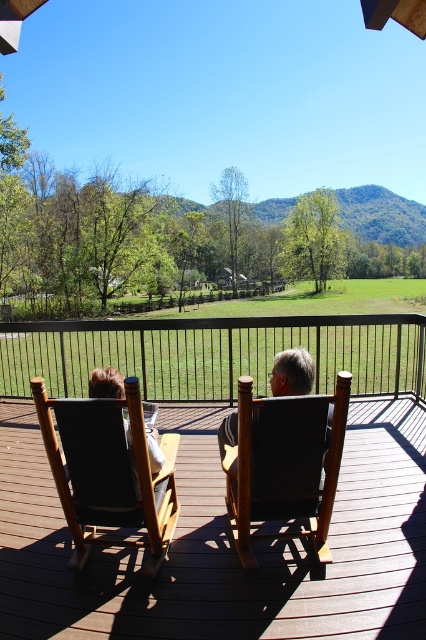
You are standing on the wooden deck and want to move from the dark gray fabric beach chair at left to the black fabric chair at center. Which direction should you move to reach it?

You should move forward to reach the black fabric chair at center because it is behind the dark gray fabric beach chair at left.

You are standing on the wooden deck and want to move to the dark gray fabric beach chair at left. Which direction should you walk to reach it?

The dark gray fabric beach chair at left is located at point 0.739 on the x axis and 0.254 on the y axis, so you should walk towards the left side of the deck to reach it.

You are standing on the wooden deck and want to sit in one of the chairs. Which chair, the dark gray fabric chair at center or the brown leather chair at center, is nearer to you?

The dark gray fabric chair at center is closer to the viewer than the brown leather chair at center, so the dark gray fabric chair at center is nearer to you.